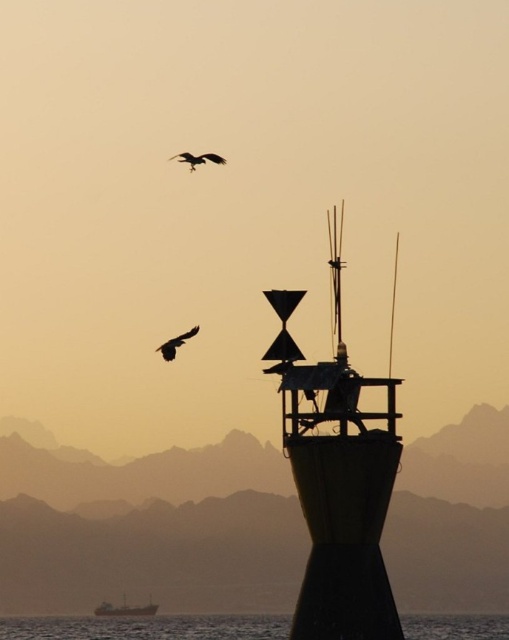
Question: Is metallic gray boat at lower left further to the viewer compared to dark brown feathered bird at upper left?

Choices:
 (A) yes
 (B) no

Answer: (A)

Question: Which point is farther to the camera?

Choices:
 (A) (137, 608)
 (B) (179, 344)
 (C) (353, 401)
 (D) (199, 156)

Answer: (A)

Question: Does dark brown feathered bird at upper left have a greater width compared to silhouette feathered bird at upper center?

Choices:
 (A) no
 (B) yes

Answer: (A)

Question: Which point is farther to the camera?

Choices:
 (A) (212, 154)
 (B) (169, 348)
 (C) (132, 605)
 (D) (192, 621)

Answer: (C)

Question: Can you confirm if green matte tower at center is positioned below metallic gray boat at lower left?

Choices:
 (A) yes
 (B) no

Answer: (B)

Question: Which of the following is the closest to the observer?

Choices:
 (A) green matte tower at center
 (B) metallic gray boat at lower left
 (C) silhouette feathered bird at upper center

Answer: (A)